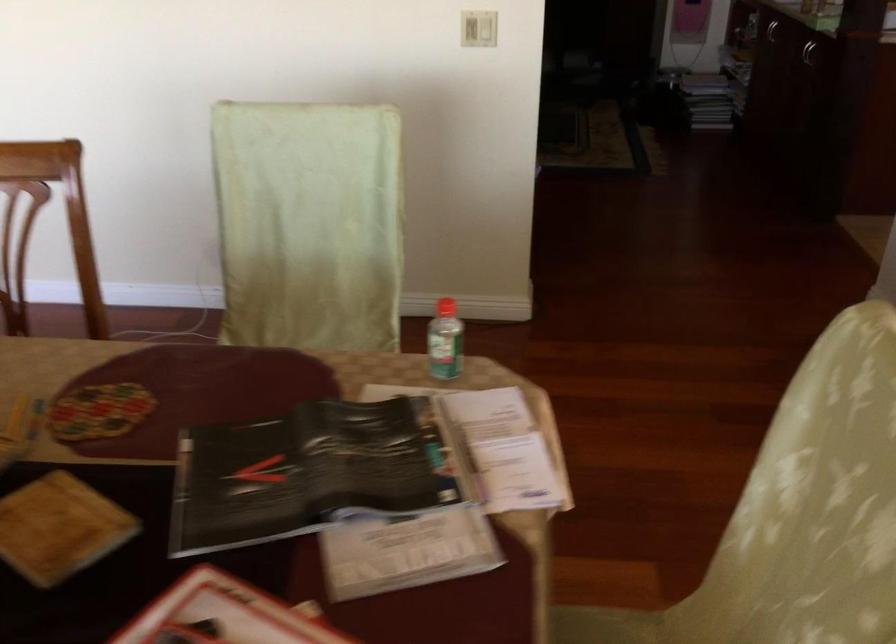
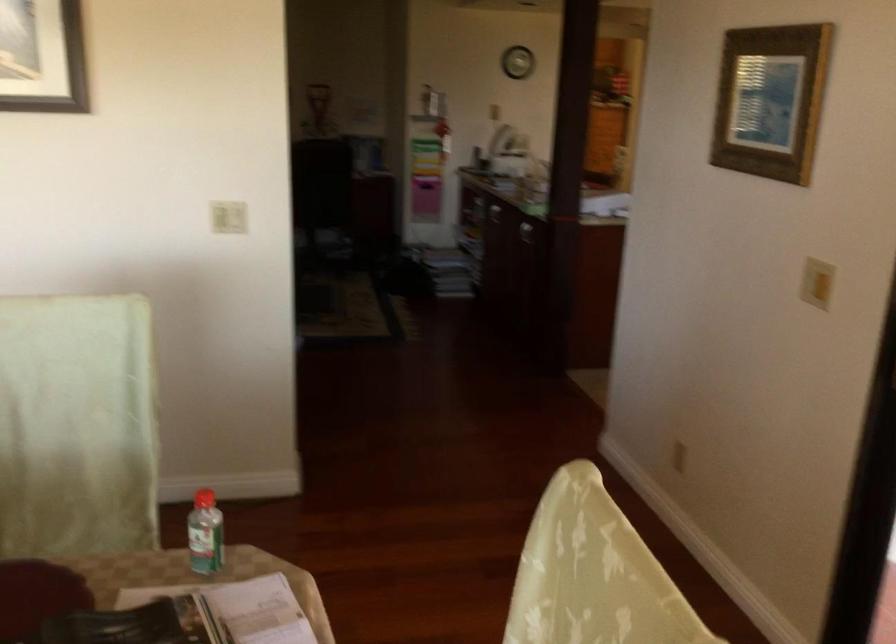
Locate, in the second image, the point that corresponds to point (444, 301) in the first image.

(203, 498)